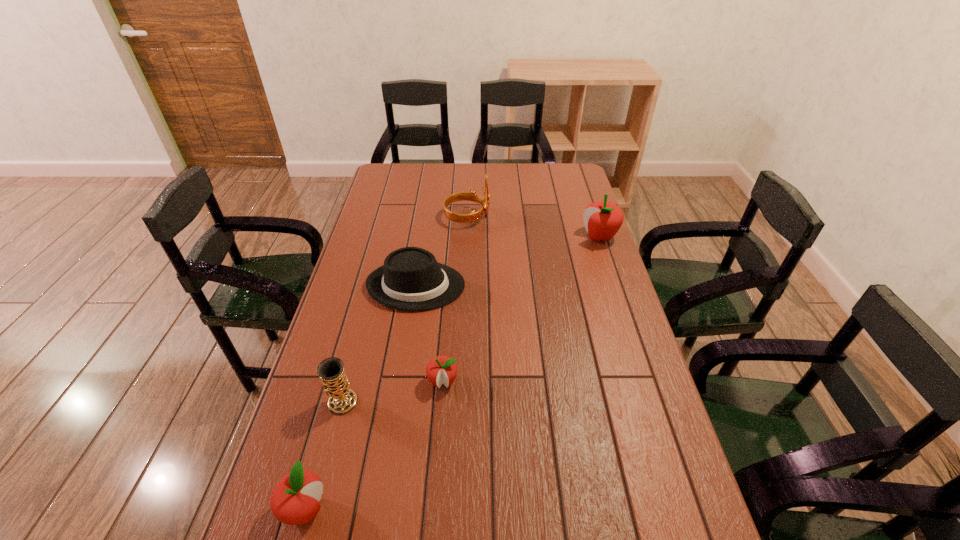
Where is `free spot between the farthest apple and the third tallest object`? The height and width of the screenshot is (540, 960). free spot between the farthest apple and the third tallest object is located at coordinates (471, 320).

I want to click on free space that is in between the tiara and the fedora, so click(x=442, y=252).

You are a GUI agent. You are given a task and a screenshot of the screen. Output one action in this format:
    pyautogui.click(x=<x>, y=<y>)
    Task: Click on the free space between the second apple from right to left and the third tallest object
    
    Given the screenshot: What is the action you would take?
    pyautogui.click(x=393, y=392)

Identify the location of free space between the tiara and the fedora. (442, 252).

Image resolution: width=960 pixels, height=540 pixels. I want to click on vacant space that is in between the nearest apple and the tiara, so click(386, 363).

This screenshot has height=540, width=960. What are the coordinates of `vacant area that lies between the third farthest object and the rightmost object` in the screenshot? It's located at (508, 261).

Point out which object is positioned as the fourth nearest to the fourth nearest object. Please provide its 2D coordinates. Your answer should be formatted as a tuple, i.e. [(x, y)], where the tuple contains the x and y coordinates of a point satisfying the conditions above.

[(602, 219)]

Find the location of `object that ranks as the second closest to the tiara`. object that ranks as the second closest to the tiara is located at coordinates (602, 219).

Locate which apple ranks in proximity to the shortest object. Please provide its 2D coordinates. Your answer should be formatted as a tuple, i.e. [(x, y)], where the tuple contains the x and y coordinates of a point satisfying the conditions above.

[(294, 500)]

This screenshot has height=540, width=960. I want to click on apple that is the closest to the second farthest apple, so click(294, 500).